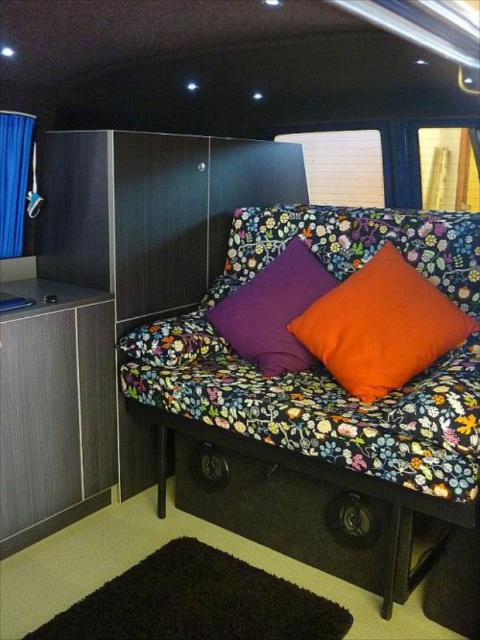
Which is more to the right, floral fabric couch at center or blue fabric curtain at left?

Positioned to the right is floral fabric couch at center.

Does floral fabric couch at center have a greater width compared to blue fabric curtain at left?

Indeed, floral fabric couch at center has a greater width compared to blue fabric curtain at left.

Who is more distant from viewer, (282, 486) or (31, 156)?

Positioned behind is point (31, 156).

At what (x,y) coordinates should I click in order to perform the action: click on floral fabric couch at center. Please return your answer as a coordinate pair (x, y). This screenshot has width=480, height=640. Looking at the image, I should click on [x=321, y=408].

Does point (257, 253) come closer to viewer compared to point (382, 336)?

No, (257, 253) is further to viewer.

Between point (336, 413) and point (394, 268), which one is positioned behind?

The point (394, 268) is more distant.

The image size is (480, 640). Find the location of `floral fabric couch at center`. floral fabric couch at center is located at coordinates (321, 408).

Is floral fabric couch at center wider than purple fabric pillow at center?

Correct, the width of floral fabric couch at center exceeds that of purple fabric pillow at center.

Does floral fabric couch at center come behind purple fabric pillow at center?

No.

The height and width of the screenshot is (640, 480). In order to click on floral fabric couch at center in this screenshot , I will do `click(321, 408)`.

Locate an element on the screen. This screenshot has height=640, width=480. floral fabric couch at center is located at coordinates (321, 408).